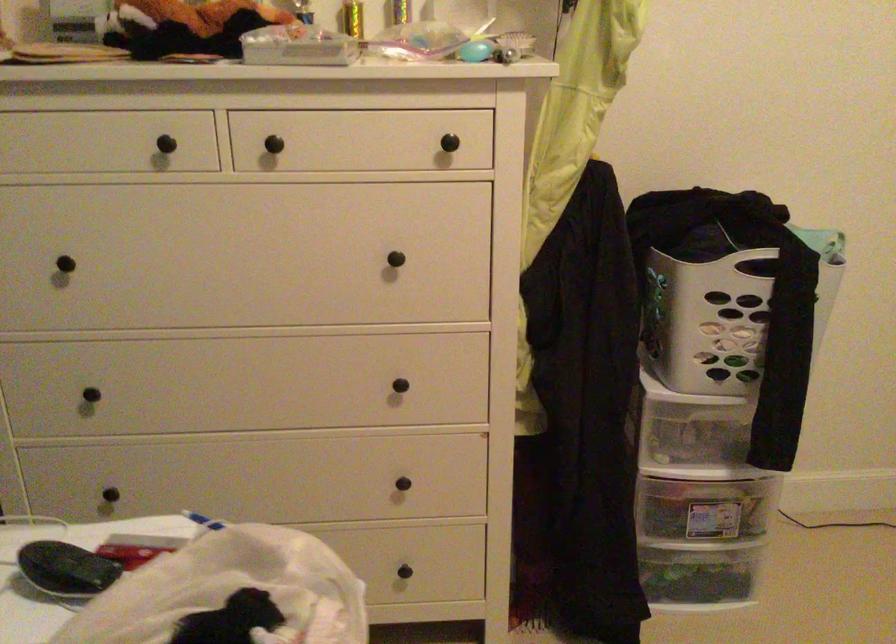
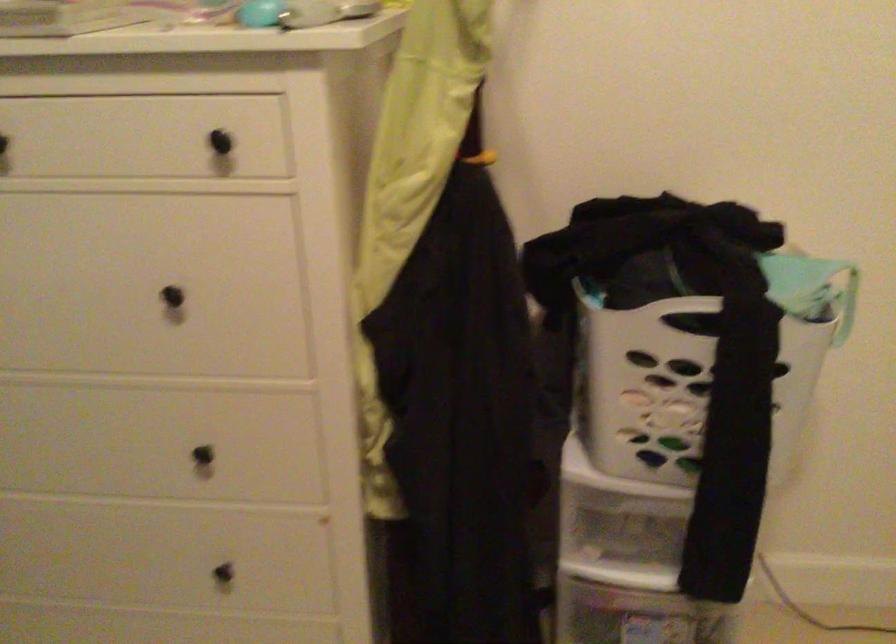
Locate, in the second image, the point that corresponds to pixel 444 138 in the first image.

(220, 142)